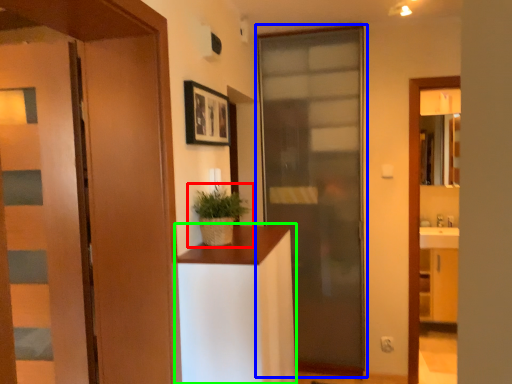
Question: Which is nearer to the houseplant (highlighted by a red box)? door (highlighted by a blue box) or cabinetry (highlighted by a green box).

Choices:
 (A) door
 (B) cabinetry

Answer: (B)